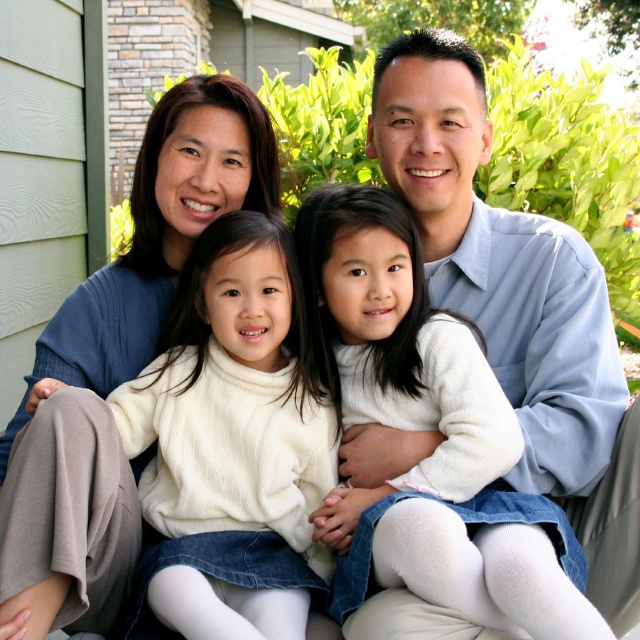
Question: Which is farther from the light blue shirt at upper right?

Choices:
 (A) matte blue sweater at upper left
 (B) white fuzzy sweater at center

Answer: (A)

Question: Which of the following is the farthest from the observer?

Choices:
 (A) light blue shirt at upper right
 (B) matte blue sweater at upper left
 (C) white fuzzy sweater at center

Answer: (A)

Question: Which of these objects is positioned closest to the matte blue sweater at upper left?

Choices:
 (A) light blue shirt at upper right
 (B) white fuzzy sweater at center

Answer: (B)

Question: Does light blue shirt at upper right have a smaller size compared to matte blue sweater at upper left?

Choices:
 (A) yes
 (B) no

Answer: (A)

Question: Can you confirm if light blue shirt at upper right is positioned to the right of matte blue sweater at upper left?

Choices:
 (A) yes
 (B) no

Answer: (A)

Question: Is light blue shirt at upper right above matte blue sweater at upper left?

Choices:
 (A) yes
 (B) no

Answer: (A)